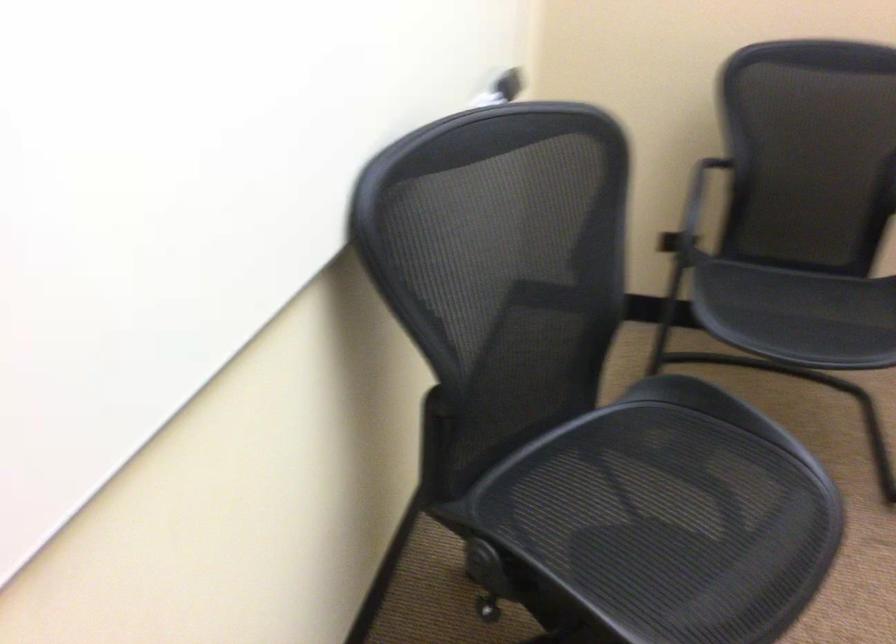
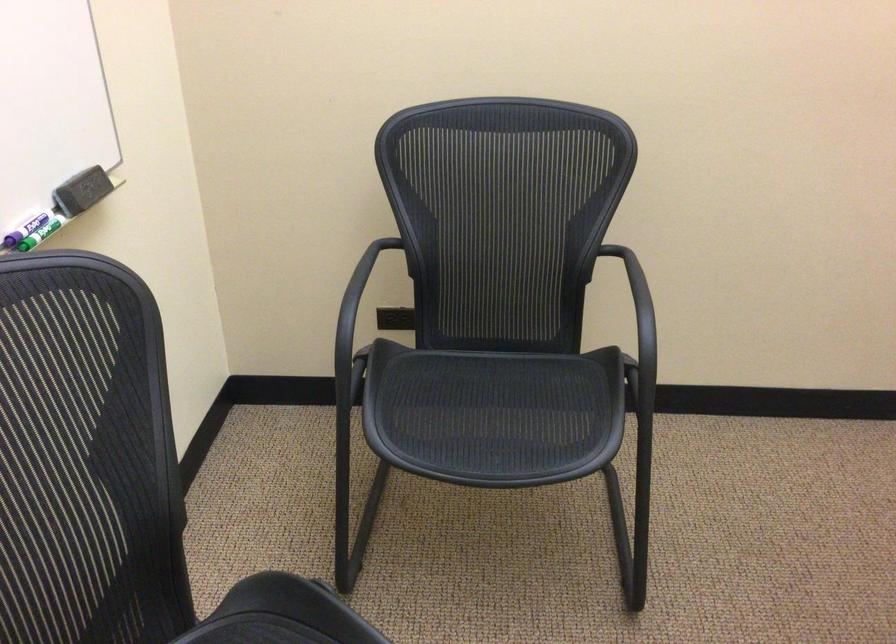
Find the pixel in the second image that matches the point at 474,97 in the first image.

(26, 228)